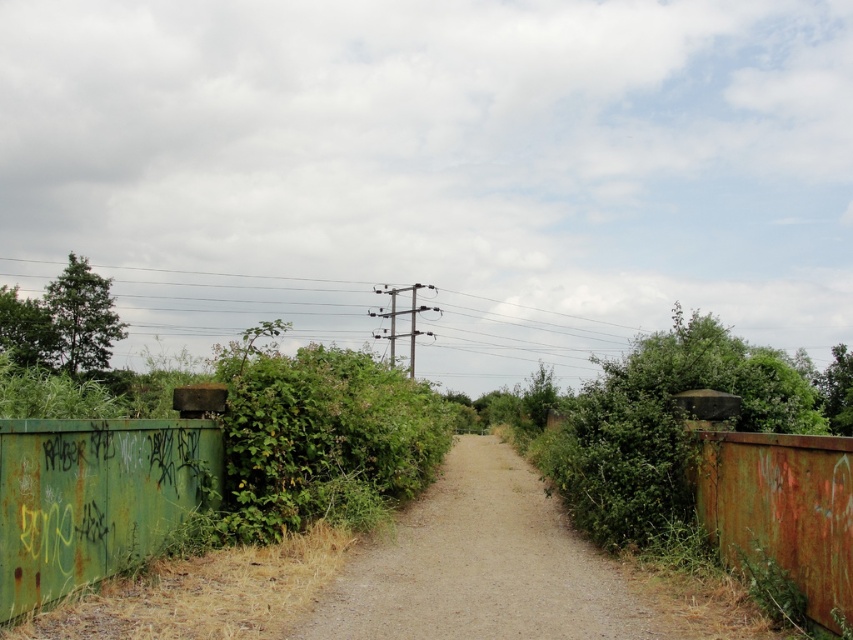
Question: Which of these objects is positioned farthest from the brown gravel path at center?

Choices:
 (A) rusty green metal fence at lower left
 (B) rusty metal fence at right

Answer: (A)

Question: Is rusty green metal fence at lower left thinner than rusty metal fence at right?

Choices:
 (A) yes
 (B) no

Answer: (A)

Question: Which point is closer to the camera taking this photo?

Choices:
 (A) (212, 444)
 (B) (428, 579)
 (C) (831, 600)

Answer: (C)

Question: Is the position of brown gravel path at center less distant than that of rusty metal fence at right?

Choices:
 (A) yes
 (B) no

Answer: (B)

Question: Can you confirm if rusty green metal fence at lower left is smaller than rusty metal fence at right?

Choices:
 (A) no
 (B) yes

Answer: (B)

Question: Which object appears closest to the camera in this image?

Choices:
 (A) brown gravel path at center
 (B) rusty metal fence at right
 (C) rusty green metal fence at lower left

Answer: (B)